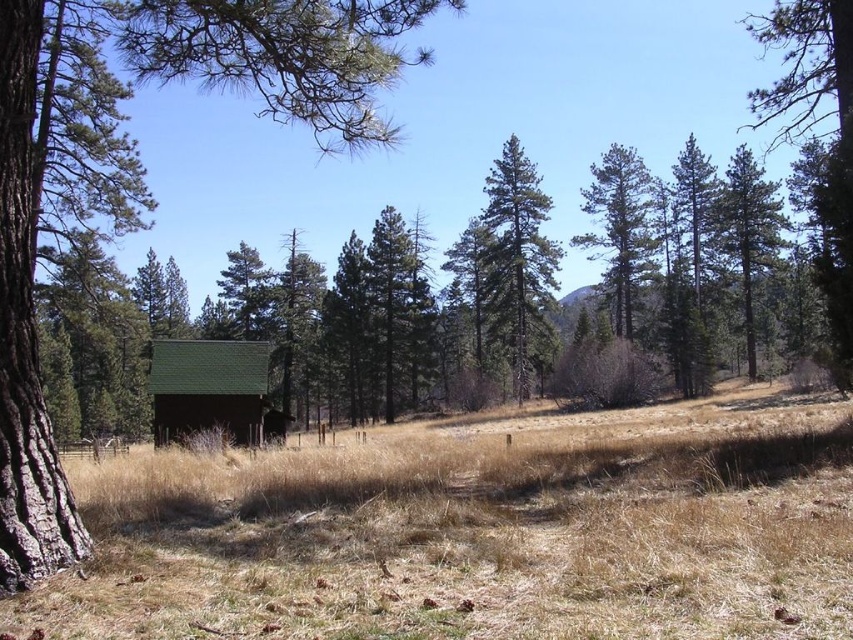
Locate an element on the screen. The width and height of the screenshot is (853, 640). brown dry grass at center is located at coordinates (480, 532).

Find the location of a particular element. brown dry grass at center is located at coordinates point(480,532).

Looking at this image, who is taller, green textured pine tree at center or green shingled cabin at lower left?

With more height is green textured pine tree at center.

Can you confirm if green textured pine tree at center is positioned to the left of green shingled cabin at lower left?

Incorrect, green textured pine tree at center is not on the left side of green shingled cabin at lower left.

The width and height of the screenshot is (853, 640). What do you see at coordinates (517, 259) in the screenshot?
I see `green textured pine tree at center` at bounding box center [517, 259].

I want to click on green textured pine tree at center, so click(517, 259).

Is brown dry grass at center positioned before green pine tree at upper right?

Yes, brown dry grass at center is in front of green pine tree at upper right.

Is point (200, 621) in front of point (753, 356)?

Yes, it is in front of point (753, 356).

Is point (343, 586) positioned in front of point (730, 244)?

Yes, point (343, 586) is in front of point (730, 244).

Image resolution: width=853 pixels, height=640 pixels. Identify the location of brown dry grass at center. (480, 532).